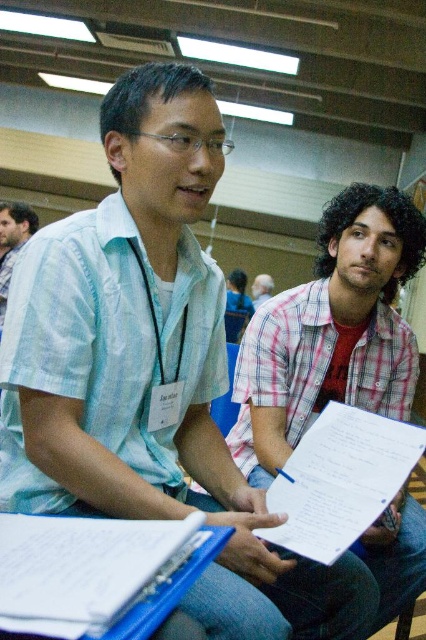
Question: Is white paper at center to the right of light blue shirt at center from the viewer's perspective?

Choices:
 (A) yes
 (B) no

Answer: (B)

Question: Which of the following is the farthest from the observer?

Choices:
 (A) matte blue shirt at center
 (B) light blue shirt at center
 (C) white paper at center
 (D) pink checkered shirt at center

Answer: (B)

Question: Which point appears farthest from the camera in this image?

Choices:
 (A) (264, 278)
 (B) (293, 445)
 (C) (2, 220)

Answer: (A)

Question: Is matte blue shirt at center above light blue shirt at center?

Choices:
 (A) yes
 (B) no

Answer: (A)

Question: Is pink checkered shirt at center to the right of light blue shirt at center from the viewer's perspective?

Choices:
 (A) yes
 (B) no

Answer: (B)

Question: Which object is the closest to the light blue shirt at center?

Choices:
 (A) pink checkered shirt at center
 (B) matte blue shirt at center

Answer: (B)